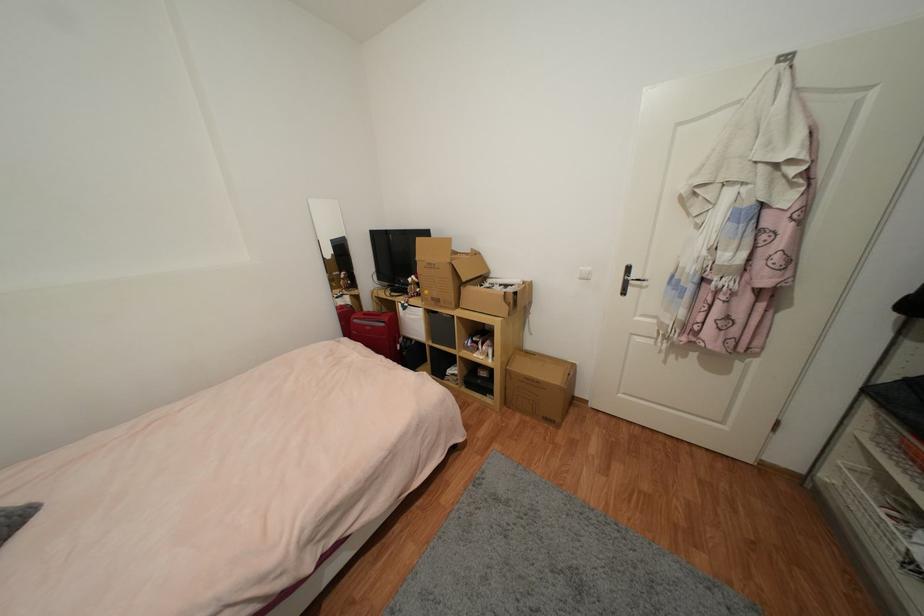
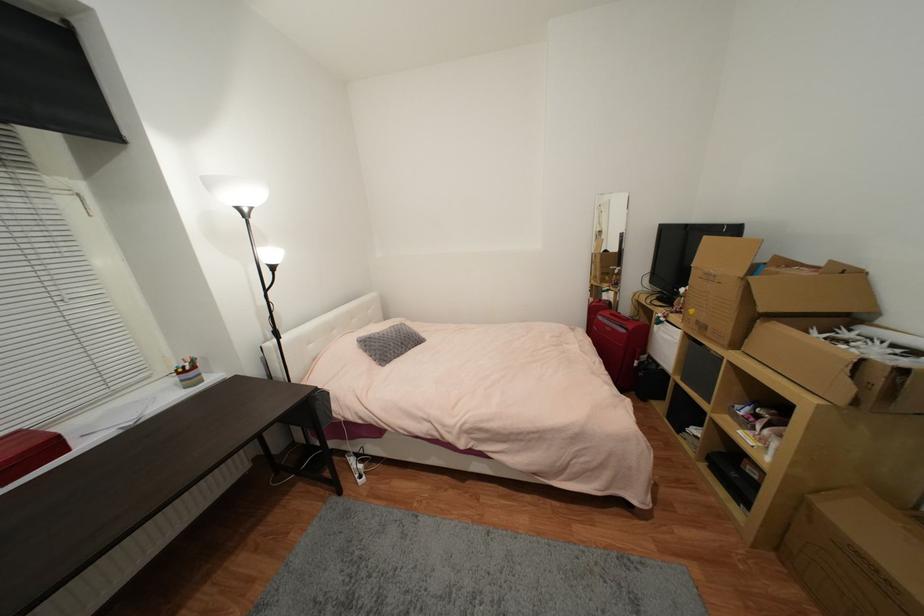
In the second image, find the point that corresponds to (441,302) in the first image.

(708, 329)